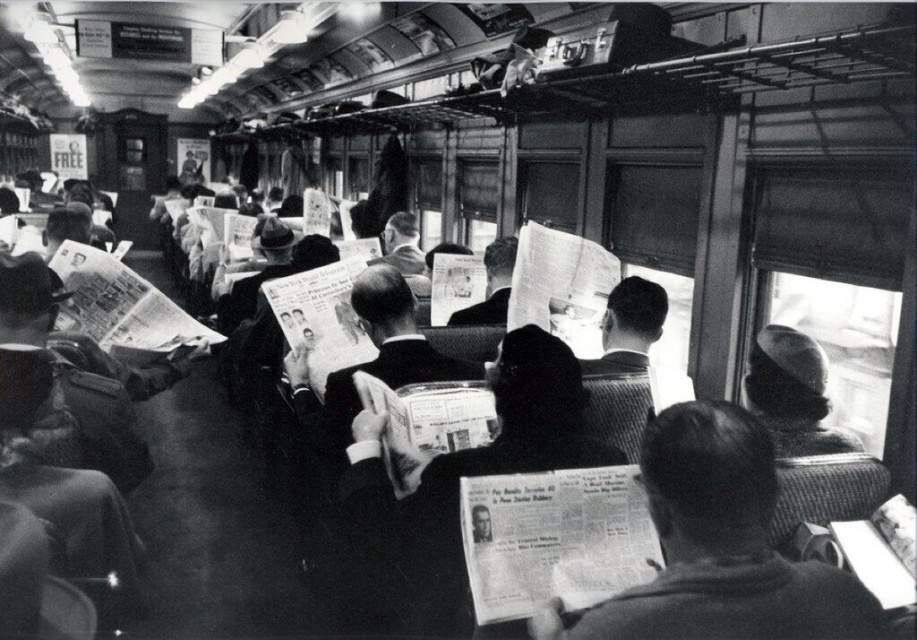
Is smooth black coat at center positioned behind smooth gray hat at right?

That is False.

Who is more distant from viewer, [743,516] or [781,348]?

The point [781,348] is more distant.

Is point (672, 541) behind point (772, 392)?

No, (672, 541) is closer to viewer.

At what (x,y) coordinates should I click in order to perform the action: click on smooth black coat at center. Please return your answer as a coordinate pair (x, y). Looking at the image, I should click on (719, 547).